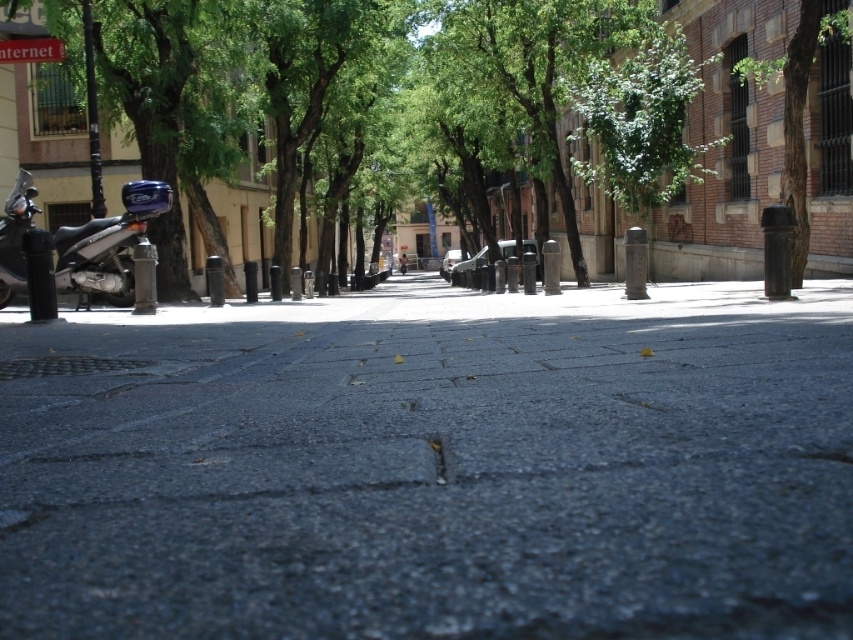
Question: Does green leafy tree at center appear under green leafy tree at upper center?

Choices:
 (A) no
 (B) yes

Answer: (A)

Question: Which of the following is the closest to the observer?

Choices:
 (A) (496, 324)
 (B) (792, 108)

Answer: (A)

Question: Among these points, which one is farthest from the camera?

Choices:
 (A) (614, 120)
 (B) (221, 118)

Answer: (A)

Question: Which point is closer to the camera?

Choices:
 (A) brown rough bark tree at right
 (B) gray asphalt pavement at center
 (C) green leafy tree at left

Answer: (B)

Question: Is green leafy tree at center further to the viewer compared to green leafy tree at left?

Choices:
 (A) no
 (B) yes

Answer: (A)

Question: Does green leafy tree at center appear on the right side of brown rough bark tree at right?

Choices:
 (A) yes
 (B) no

Answer: (B)